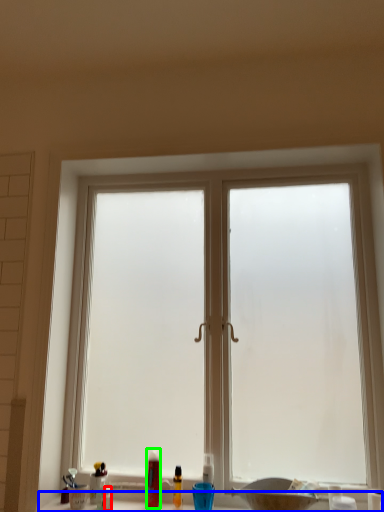
Question: Estimate the real-world distances between objects in this image. Which object is farther from toiletry (highlighted by a red box), counter top (highlighted by a blue box) or toiletry (highlighted by a green box)?

Choices:
 (A) counter top
 (B) toiletry

Answer: (B)